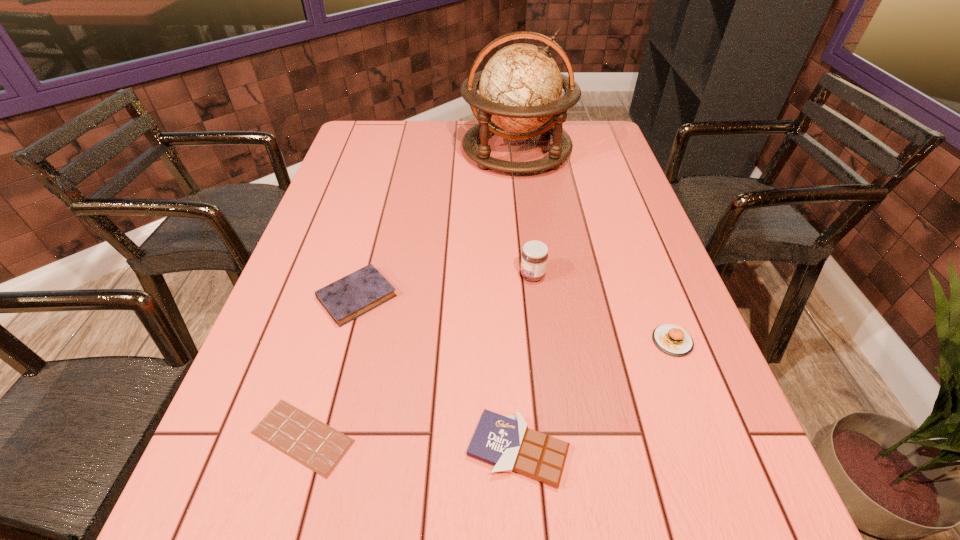
The image size is (960, 540). What are the coordinates of `vacant space located on the front label of the second tallest object` in the screenshot? It's located at (380, 275).

Where is `vacant space located on the front label of the second tallest object`? vacant space located on the front label of the second tallest object is located at coordinates pos(467,275).

Where is `blank area located on the left of the rightmost object`? Image resolution: width=960 pixels, height=540 pixels. blank area located on the left of the rightmost object is located at coordinates (596, 341).

I want to click on blank area located on the left of the taller chocolate bar, so click(x=289, y=450).

Where is `vacant space situated on the back of the diary`? The image size is (960, 540). vacant space situated on the back of the diary is located at coordinates (387, 182).

Locate an element on the screen. This screenshot has height=540, width=960. vacant space situated on the back of the shorter chocolate bar is located at coordinates (324, 364).

The image size is (960, 540). In order to click on object situated at the far edge in this screenshot , I will do tap(520, 88).

Find the location of a particular element. diary present at the left edge is located at coordinates (348, 298).

Locate an element on the screen. This screenshot has height=540, width=960. chocolate bar situated at the left edge is located at coordinates (319, 447).

Locate an element on the screen. The height and width of the screenshot is (540, 960). globe that is positioned at the right edge is located at coordinates (520, 88).